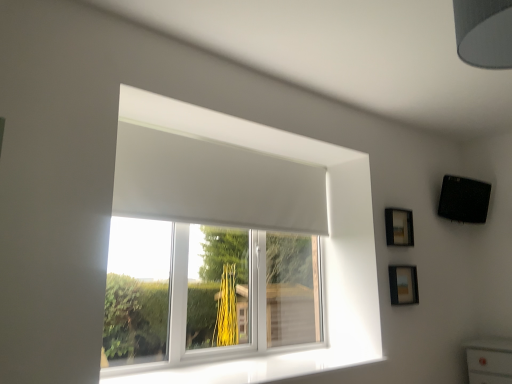
The height and width of the screenshot is (384, 512). What do you see at coordinates (484, 32) in the screenshot?
I see `gray fabric lampshade at upper right` at bounding box center [484, 32].

This screenshot has height=384, width=512. What do you see at coordinates (399, 227) in the screenshot?
I see `wooden frame at upper right, the 2th picture frame from the bottom` at bounding box center [399, 227].

This screenshot has height=384, width=512. Describe the element at coordinates (403, 285) in the screenshot. I see `matte black picture frame at lower right, the 2th picture frame when ordered from top to bottom` at that location.

Identify the location of white matte window at center. This screenshot has height=384, width=512. (257, 226).

Is white matte window at center in front of gray fabric lampshade at upper right?

No, white matte window at center is behind gray fabric lampshade at upper right.

Is gray fabric lampshade at upper right inside white matte window at center?

Actually, gray fabric lampshade at upper right is outside white matte window at center.

Is white matte window at center beside gray fabric lampshade at upper right?

No, white matte window at center is not touching gray fabric lampshade at upper right.

Between white matte window at center and gray fabric lampshade at upper right, which one has smaller size?

gray fabric lampshade at upper right.

Is wooden frame at upper right, acting as the first picture frame starting from the top, to the left of white glossy window sill at lower center from the viewer's perspective?

Incorrect, wooden frame at upper right, acting as the first picture frame starting from the top, is not on the left side of white glossy window sill at lower center.

From a real-world perspective, is wooden frame at upper right, acting as the first picture frame starting from the top, above or below white glossy window sill at lower center?

wooden frame at upper right, acting as the first picture frame starting from the top, is situated higher than white glossy window sill at lower center in the real world.

From the image's perspective, which one is positioned higher, wooden frame at upper right, acting as the first picture frame starting from the top, or white glossy window sill at lower center?

wooden frame at upper right, acting as the first picture frame starting from the top, is shown above in the image.

How much distance is there between gray fabric lampshade at upper right and wooden frame at upper right, the 2th picture frame from the bottom?

gray fabric lampshade at upper right is 1.66 meters from wooden frame at upper right, the 2th picture frame from the bottom.

Considering the sizes of objects gray fabric lampshade at upper right and wooden frame at upper right, the 2th picture frame from the bottom, in the image provided, who is taller, gray fabric lampshade at upper right or wooden frame at upper right, the 2th picture frame from the bottom,?

With more height is gray fabric lampshade at upper right.

From the image's perspective, is gray fabric lampshade at upper right located above or below wooden frame at upper right, the 2th picture frame from the bottom?

gray fabric lampshade at upper right is above wooden frame at upper right, the 2th picture frame from the bottom.

Considering the sizes of objects matte black picture frame at lower right, the 2th picture frame when ordered from top to bottom, and white matte window at center in the image provided, who is smaller, matte black picture frame at lower right, the 2th picture frame when ordered from top to bottom, or white matte window at center?

matte black picture frame at lower right, the 2th picture frame when ordered from top to bottom, is smaller.

Can white matte window at center be found inside matte black picture frame at lower right, the 2th picture frame when ordered from top to bottom?

No, matte black picture frame at lower right, the 2th picture frame when ordered from top to bottom, does not contain white matte window at center.

In terms of width, does matte black picture frame at lower right, the 2th picture frame when ordered from top to bottom, look wider or thinner when compared to white matte window at center?

Clearly, matte black picture frame at lower right, the 2th picture frame when ordered from top to bottom, has less width compared to white matte window at center.

Is point (409, 301) less distant than point (366, 328)?

No, (409, 301) is behind (366, 328).

How distant is wooden frame at upper right, acting as the first picture frame starting from the top, from matte black picture frame at lower right, the 1th picture frame positioned from the bottom?

wooden frame at upper right, acting as the first picture frame starting from the top, is 10.70 inches from matte black picture frame at lower right, the 1th picture frame positioned from the bottom.

Would you say wooden frame at upper right, the 2th picture frame from the bottom, is a long distance from matte black picture frame at lower right, the 1th picture frame positioned from the bottom?

No, wooden frame at upper right, the 2th picture frame from the bottom, is in close proximity to matte black picture frame at lower right, the 1th picture frame positioned from the bottom.

From the image's perspective, which one is positioned higher, wooden frame at upper right, the 2th picture frame from the bottom, or matte black picture frame at lower right, the 2th picture frame when ordered from top to bottom?

From the image's view, wooden frame at upper right, the 2th picture frame from the bottom, is above.

Considering the sizes of objects white glossy window sill at lower center and matte black picture frame at lower right, the 2th picture frame when ordered from top to bottom, in the image provided, who is taller, white glossy window sill at lower center or matte black picture frame at lower right, the 2th picture frame when ordered from top to bottom,?

With more height is matte black picture frame at lower right, the 2th picture frame when ordered from top to bottom.

Which is closer, (176, 380) or (400, 296)?

Point (176, 380)

Where is `the 1st picture frame positioned above the white glossy window sill at lower center (from the image's perspective)`? Image resolution: width=512 pixels, height=384 pixels. the 1st picture frame positioned above the white glossy window sill at lower center (from the image's perspective) is located at coordinates (403, 285).

Is white glossy window sill at lower center at the left side of matte black picture frame at lower right, the 1th picture frame positioned from the bottom?

Indeed, white glossy window sill at lower center is positioned on the left side of matte black picture frame at lower right, the 1th picture frame positioned from the bottom.

From the image's perspective, relative to white glossy window sill at lower center, is white matte window at center above or below?

white matte window at center is above white glossy window sill at lower center.

Is white matte window at center not near white glossy window sill at lower center?

No, white matte window at center is in close proximity to white glossy window sill at lower center.

Which of these two, white matte window at center or white glossy window sill at lower center, is wider?

With larger width is white glossy window sill at lower center.

This screenshot has height=384, width=512. In order to click on window above the white glossy window sill at lower center (from a real-world perspective) in this screenshot , I will do `click(257, 226)`.

Find the location of a particular element. This screenshot has width=512, height=384. window that appears behind the gray fabric lampshade at upper right is located at coordinates (257, 226).

Where is `picture frame that is the 2nd one above the white glossy window sill at lower center (from a real-world perspective)`? The image size is (512, 384). picture frame that is the 2nd one above the white glossy window sill at lower center (from a real-world perspective) is located at coordinates (399, 227).

From the image, which object appears to be nearer to white glossy window sill at lower center, gray fabric lampshade at upper right or matte black picture frame at lower right, the 2th picture frame when ordered from top to bottom?

matte black picture frame at lower right, the 2th picture frame when ordered from top to bottom, lies closer to white glossy window sill at lower center than the other object.

Based on their spatial positions, is matte black picture frame at lower right, the 1th picture frame positioned from the bottom, or white matte window at center closer to gray fabric lampshade at upper right?

Among the two, white matte window at center is located nearer to gray fabric lampshade at upper right.

Looking at the image, which one is located closer to white matte window at center, gray fabric lampshade at upper right or wooden frame at upper right, acting as the first picture frame starting from the top?

wooden frame at upper right, acting as the first picture frame starting from the top, is closer to white matte window at center.

From the image, which object appears to be farther from white matte window at center, matte black picture frame at lower right, the 1th picture frame positioned from the bottom, or wooden frame at upper right, acting as the first picture frame starting from the top?

matte black picture frame at lower right, the 1th picture frame positioned from the bottom.

Considering their positions, is white matte window at center positioned further to wooden frame at upper right, acting as the first picture frame starting from the top, than gray fabric lampshade at upper right?

gray fabric lampshade at upper right.

Based on their spatial positions, is wooden frame at upper right, acting as the first picture frame starting from the top, or matte black picture frame at lower right, the 1th picture frame positioned from the bottom, closer to gray fabric lampshade at upper right?

wooden frame at upper right, acting as the first picture frame starting from the top, lies closer to gray fabric lampshade at upper right than the other object.

Looking at the image, which one is located closer to wooden frame at upper right, the 2th picture frame from the bottom, gray fabric lampshade at upper right or white matte window at center?

white matte window at center.

Which object lies nearer to the anchor point white matte window at center, matte black picture frame at lower right, the 2th picture frame when ordered from top to bottom, or gray fabric lampshade at upper right?

matte black picture frame at lower right, the 2th picture frame when ordered from top to bottom, is positioned closer to the anchor white matte window at center.

The image size is (512, 384). I want to click on window sill located between white matte window at center and wooden frame at upper right, the 2th picture frame from the bottom, in the left-right direction, so click(x=245, y=367).

The width and height of the screenshot is (512, 384). What are the coordinates of `window sill positioned between gray fabric lampshade at upper right and matte black picture frame at lower right, the 2th picture frame when ordered from top to bottom, from near to far` in the screenshot? It's located at (245, 367).

Locate an element on the screen. The width and height of the screenshot is (512, 384). window sill between gray fabric lampshade at upper right and wooden frame at upper right, the 2th picture frame from the bottom, along the z-axis is located at coordinates (245, 367).

You are a GUI agent. You are given a task and a screenshot of the screen. Output one action in this format:
    pyautogui.click(x=<x>, y=<y>)
    Task: Click on the window sill between white matte window at center and matte black picture frame at lower right, the 1th picture frame positioned from the bottom, from left to right
    
    Given the screenshot: What is the action you would take?
    pyautogui.click(x=245, y=367)